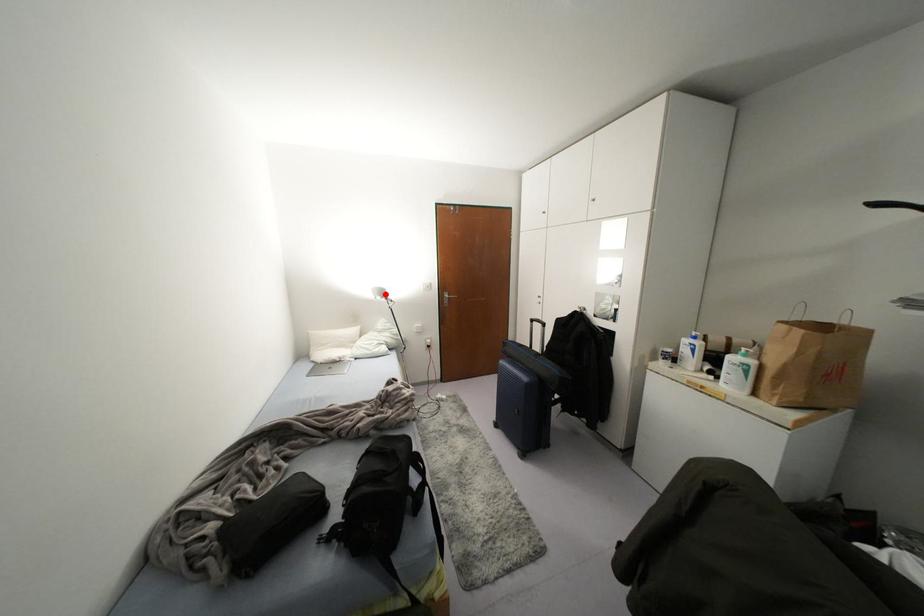
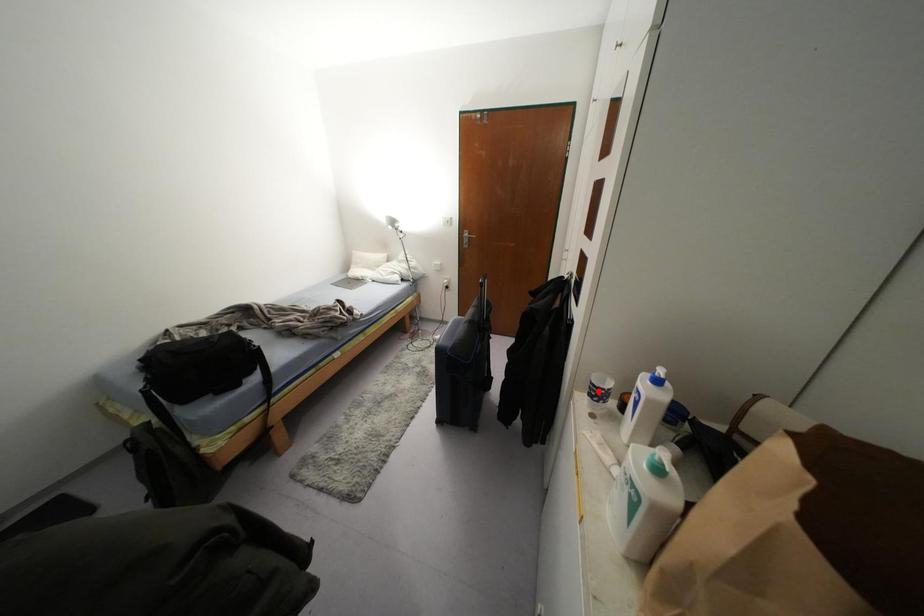
I am providing you with two images of the same scene from different viewpoints. A red point is marked on the first image and another point is marked on the second image. Is the marked point in image1 the same physical position as the marked point in image2?

No